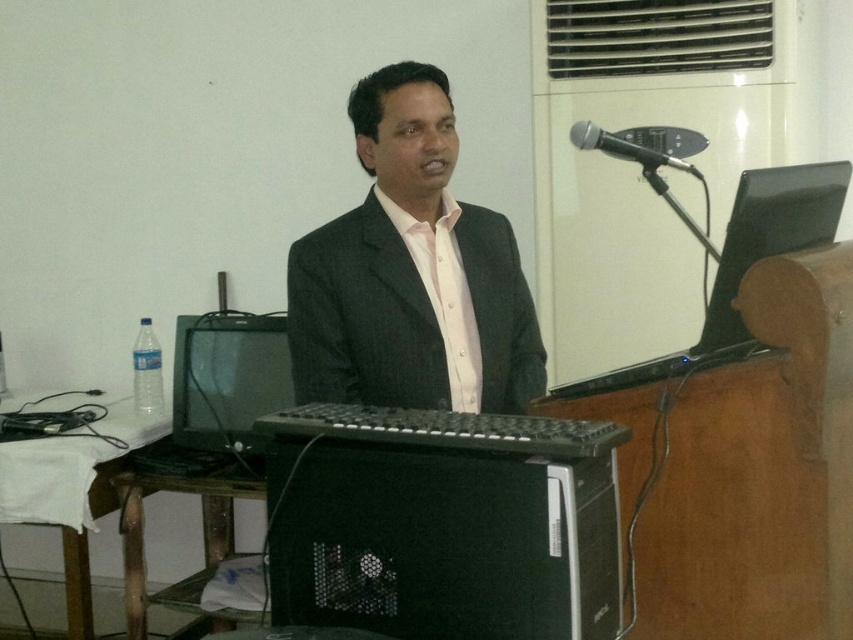
You are a photographer setting up for a presentation. You need to ensure that the matte black suit at center and the black metallic microphone at upper right are in focus simultaneously. Given that your camera has a depth of field that can cover objects within 15 inches of each other, will both objects be in focus?

The distance between the matte black suit at center and the black metallic microphone at upper right is 16.04 inches. Since the depth of field can only cover 15 inches, the two objects are slightly out of the required range. Therefore, both objects cannot be in focus at the same time.

You are a photographer setting up for a presentation. You need to place a camera 1.5 meters away from the black plastic monitor at upper right to capture the screen clearly. Is the current distance sufficient?

The black plastic monitor at upper right is currently 1.25 meters away from the camera, which is less than the required 1.5 meters. Move the camera back to achieve the desired distance.